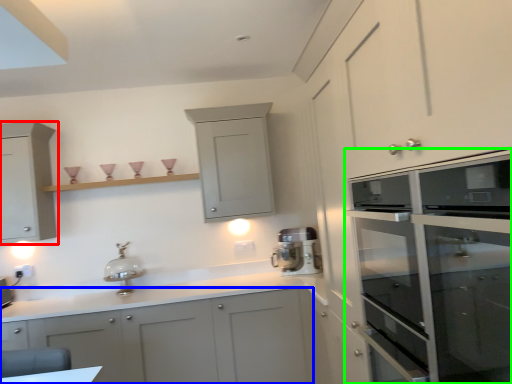
Question: Estimate the real-world distances between objects in this image. Which object is farther from cabinetry (highlighted by a red box), cabinetry (highlighted by a blue box) or cabinetry (highlighted by a green box)?

Choices:
 (A) cabinetry
 (B) cabinetry

Answer: (B)